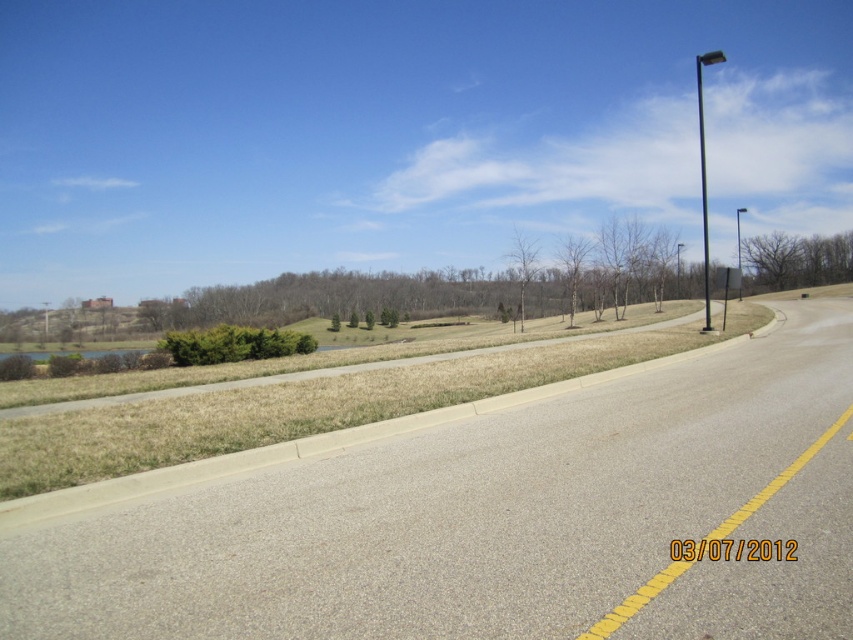
The width and height of the screenshot is (853, 640). I want to click on black metal pole at right, so click(704, 172).

Does black metal pole at right have a lesser height compared to bare branch at center?

No, black metal pole at right is not shorter than bare branch at center.

Which is behind, point (704, 147) or point (509, 248)?

Positioned behind is point (509, 248).

This screenshot has width=853, height=640. In order to click on black metal pole at right in this screenshot , I will do `click(704, 172)`.

Is the position of brown textured tree at upper right more distant than that of bare branches at center?

Yes.

Which is below, brown textured tree at upper right or bare branches at center?

bare branches at center

Describe the element at coordinates (798, 259) in the screenshot. I see `brown textured tree at upper right` at that location.

Where is `brown textured tree at upper right`? This screenshot has height=640, width=853. brown textured tree at upper right is located at coordinates (798, 259).

Does black metal pole at right have a lesser width compared to black metal pole at upper right?

Yes.

Measure the distance between black metal pole at right and camera.

black metal pole at right and camera are 96.62 feet apart.

Locate an element on the screen. black metal pole at right is located at coordinates (704, 172).